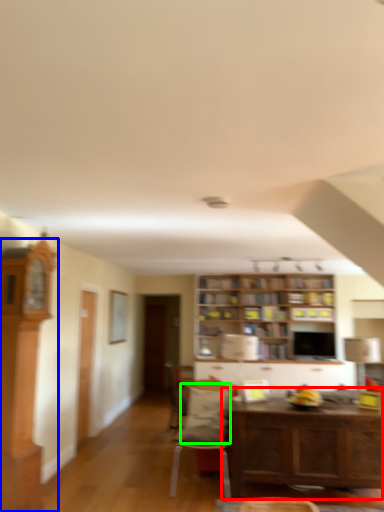
Question: Which object is positioned closest to table (highlighted by a red box)? Select from cabinetry (highlighted by a blue box) and pillow (highlighted by a green box).

Choices:
 (A) cabinetry
 (B) pillow

Answer: (B)